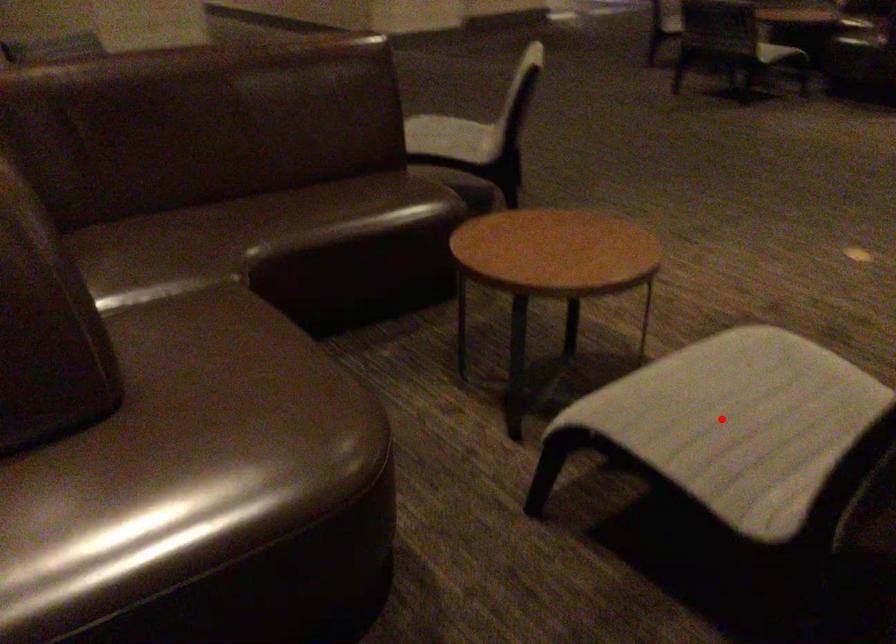
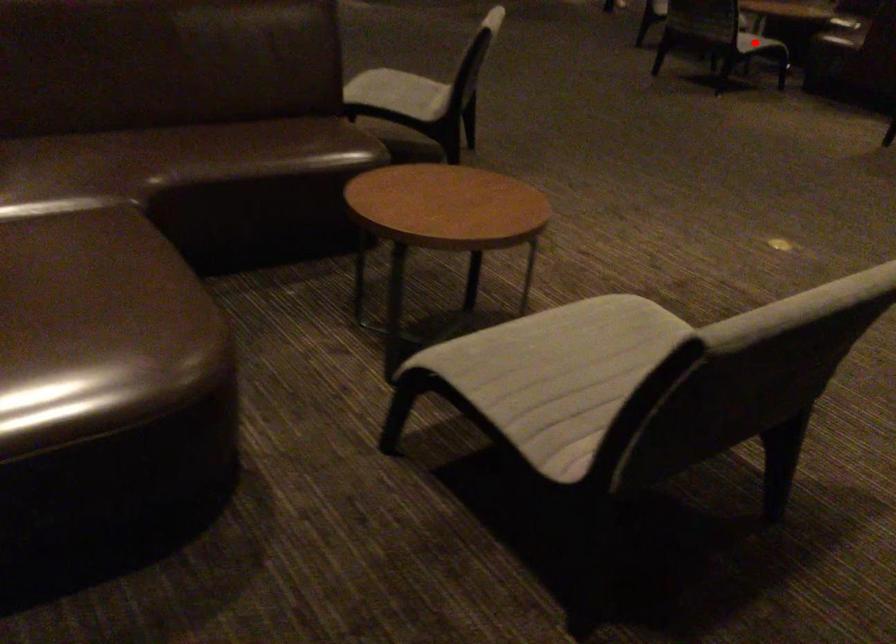
I am providing you with two images of the same scene from different viewpoints. A red point is marked on the first image and another point is marked on the second image. Are the points marked in image1 and image2 representing the same 3D position?

No